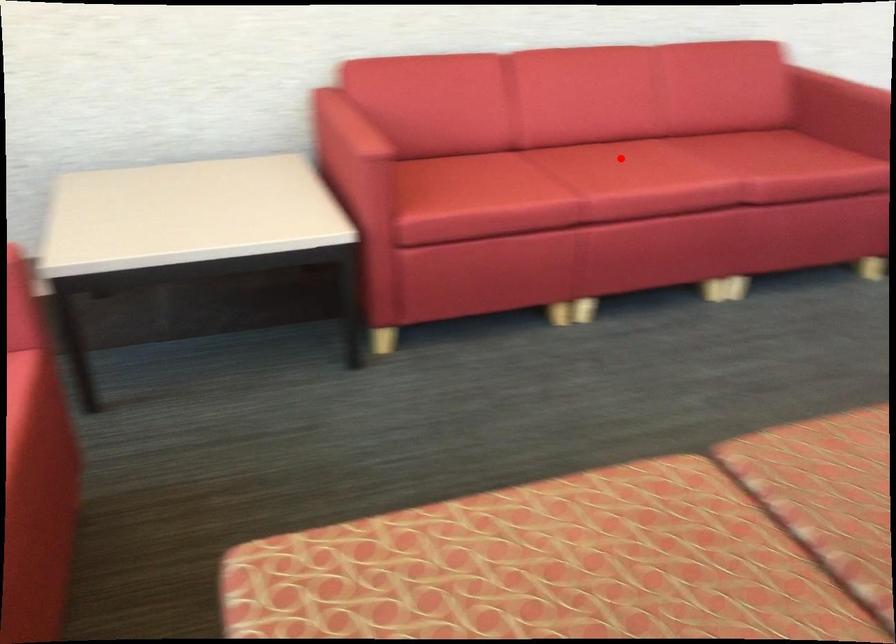
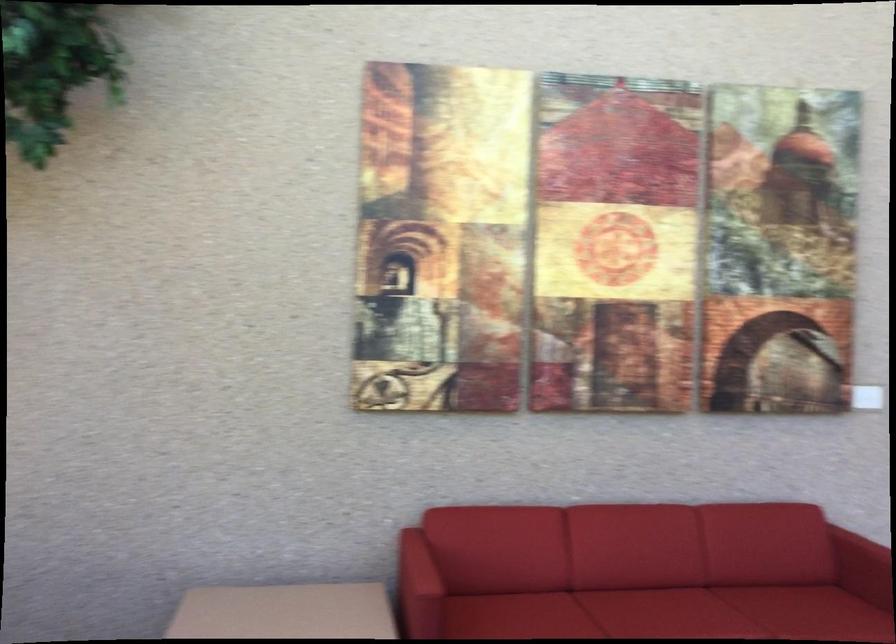
The point at the highlighted location is marked in the first image. Where is the corresponding point in the second image?

(659, 607)